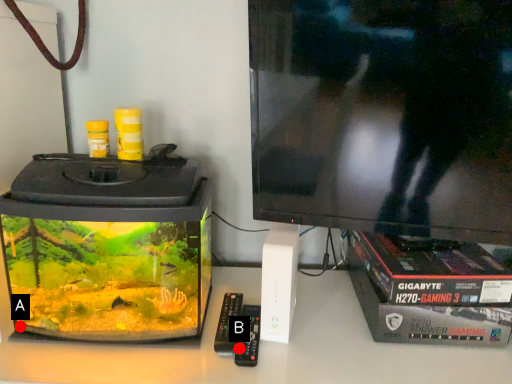
Question: Two points are circled on the image, labeled by A and B beside each circle. Which point is closer to the camera taking this photo?

Choices:
 (A) A is closer
 (B) B is closer

Answer: (B)